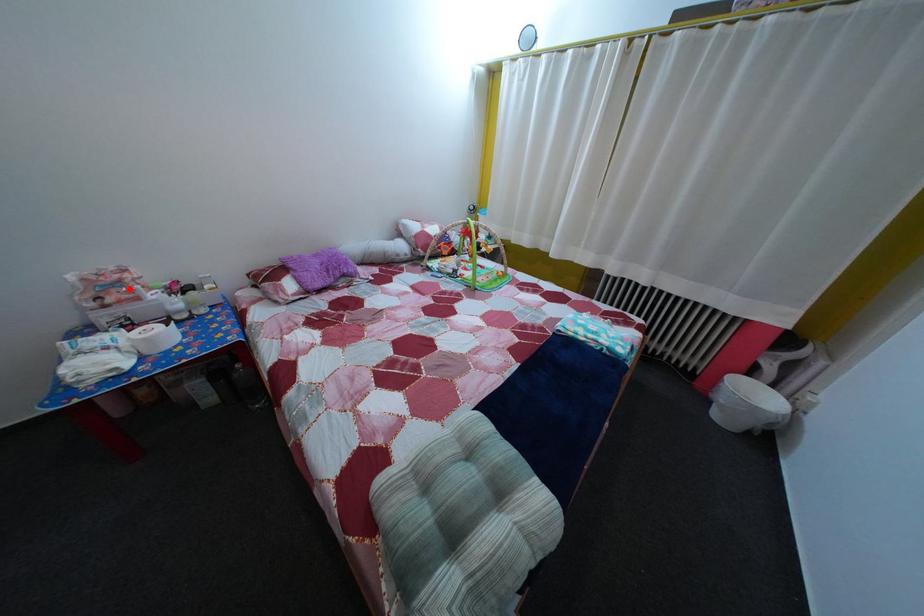
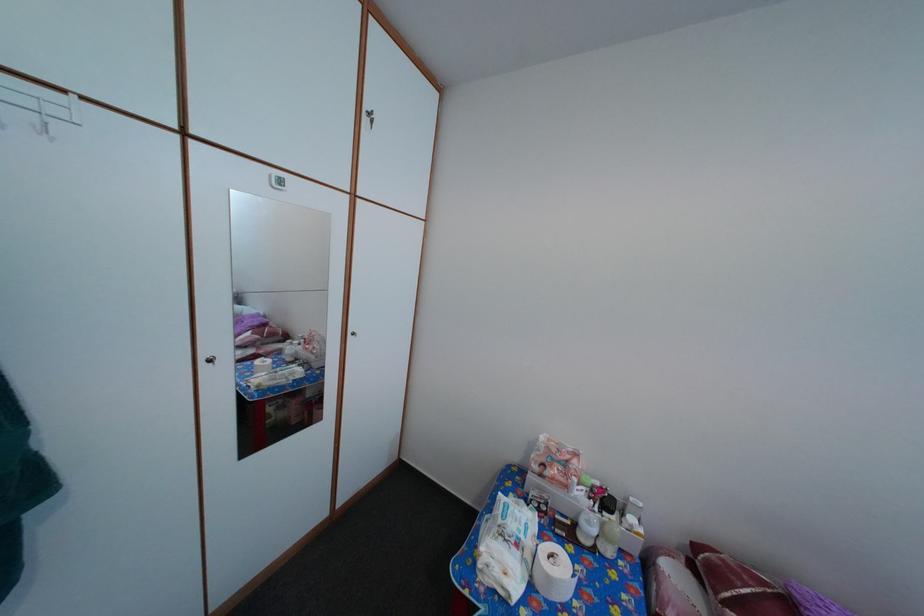
The point at the highlighted location is marked in the first image. Where is the corresponding point in the second image?

(576, 469)